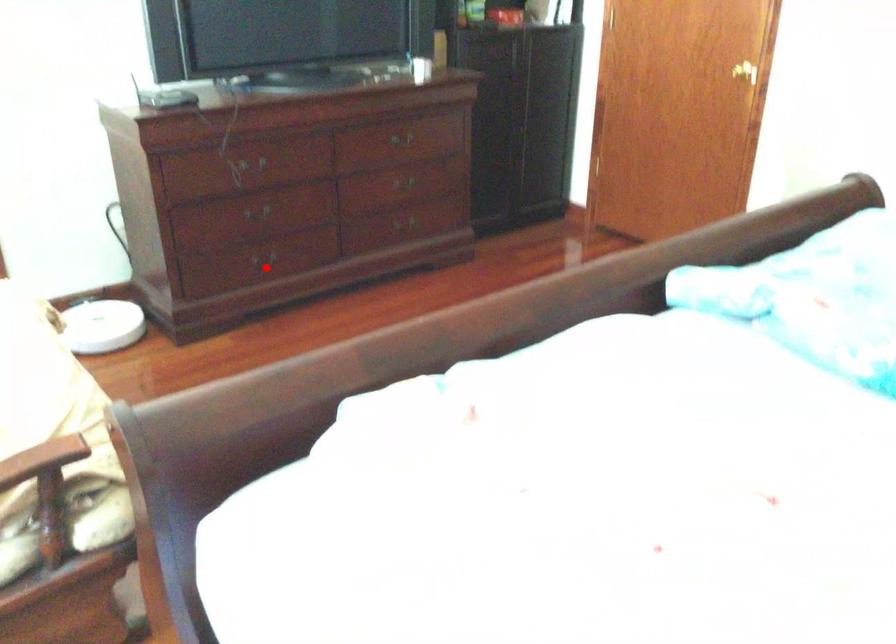
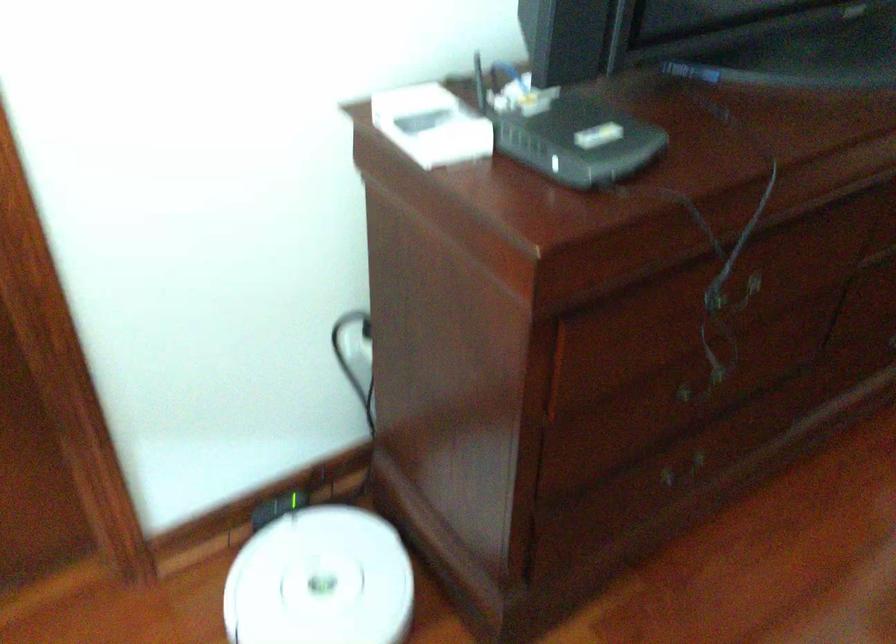
Find the pixel in the second image that matches the highlighted location in the first image.

(684, 473)